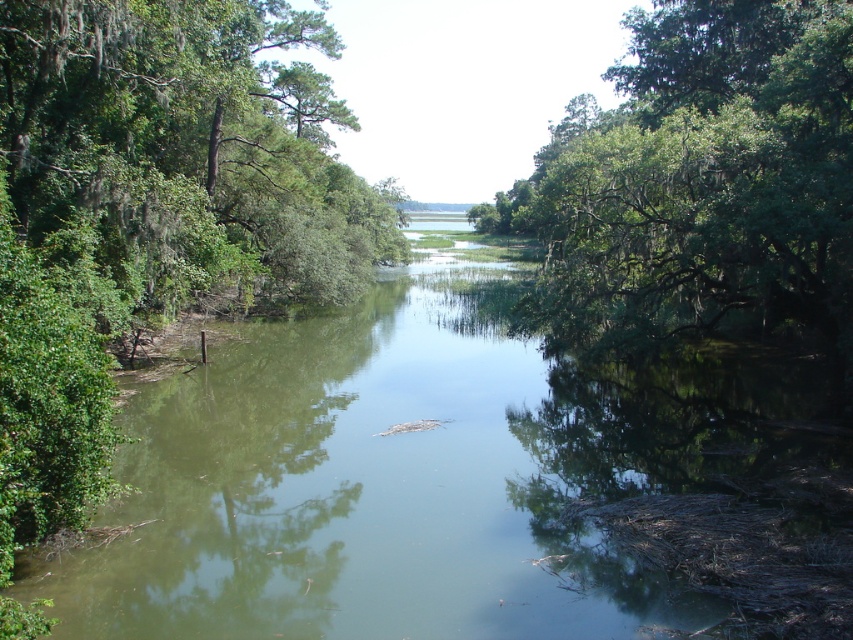
You are a kayaker planning to paddle down the waterway. You see the green reflective water at center and the green leafy tree at upper right. Which object is directly above the other?

The green leafy tree at upper right is directly above the green reflective water at center because the water is positioned under the tree.

You are navigating a small boat along the waterway in the image. You see two points marked on the water surface. The first point is at coordinates point (563,417) and the second is at point (848,308). If you are moving forward, which point will you encounter first?

Point (848,308) will be encountered first because it is in front of point (563,417), which is behind it.